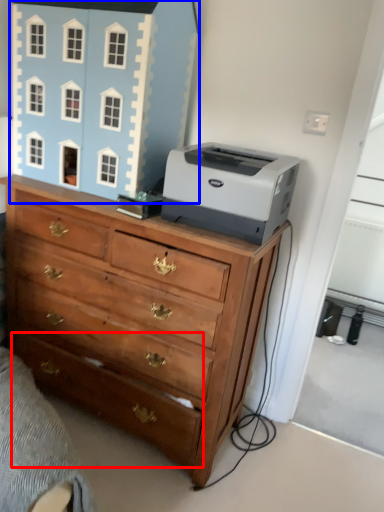
Question: Which of the following is the farthest to the observer, drawer (highlighted by a red box) or toy (highlighted by a blue box)?

Choices:
 (A) drawer
 (B) toy

Answer: (B)